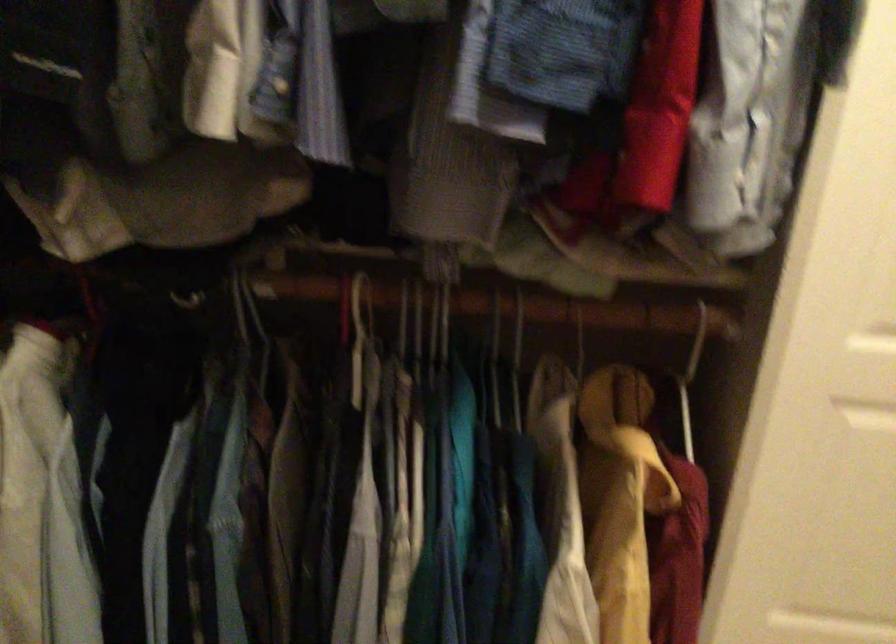
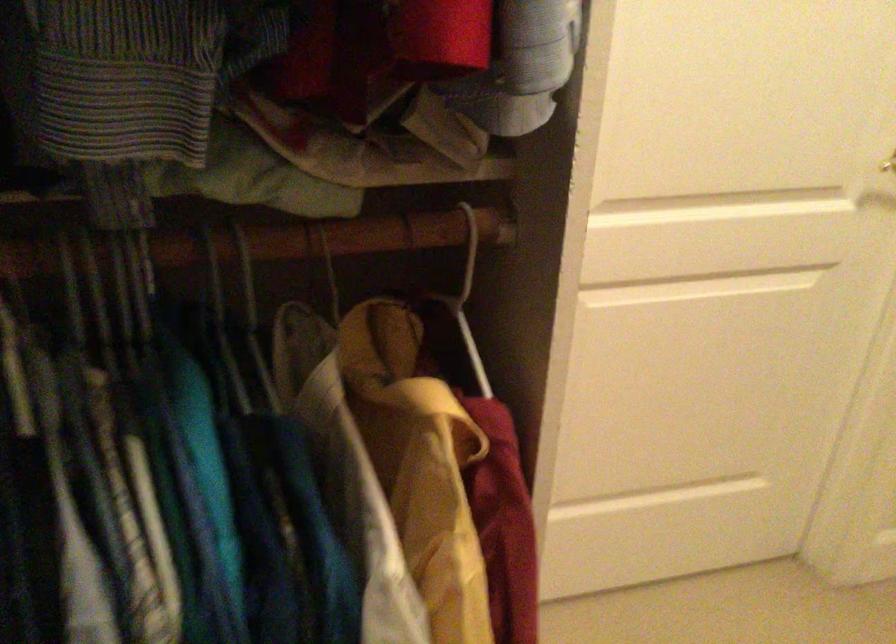
Question: The images are taken continuously from a first-person perspective. In which direction is your viewpoint rotating?

Choices:
 (A) Left
 (B) Right
 (C) Up
 (D) Down

Answer: (B)